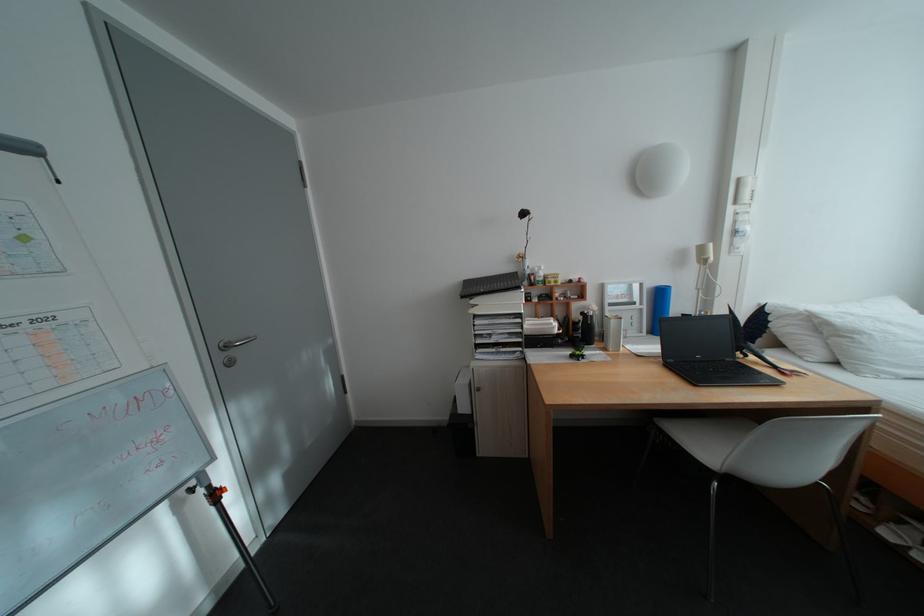
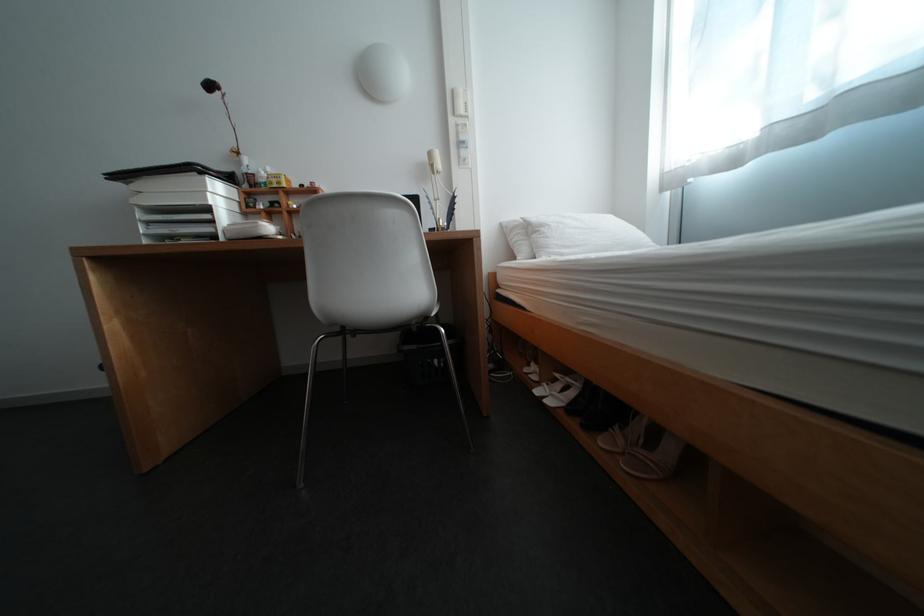
Where in the second image is the point corresponding to pixel 871 334 from the first image?

(555, 228)